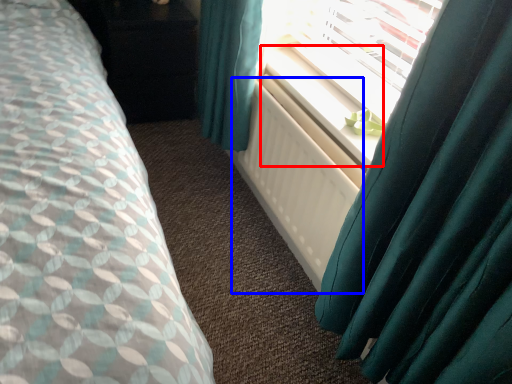
Question: Which object is closer to the camera taking this photo, window sill (highlighted by a red box) or radiator (highlighted by a blue box)?

Choices:
 (A) window sill
 (B) radiator

Answer: (B)